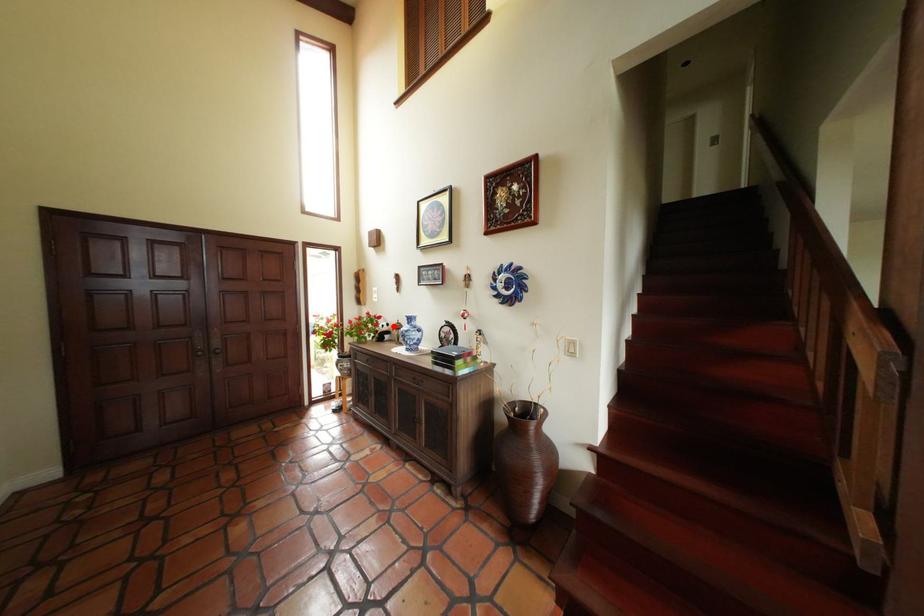
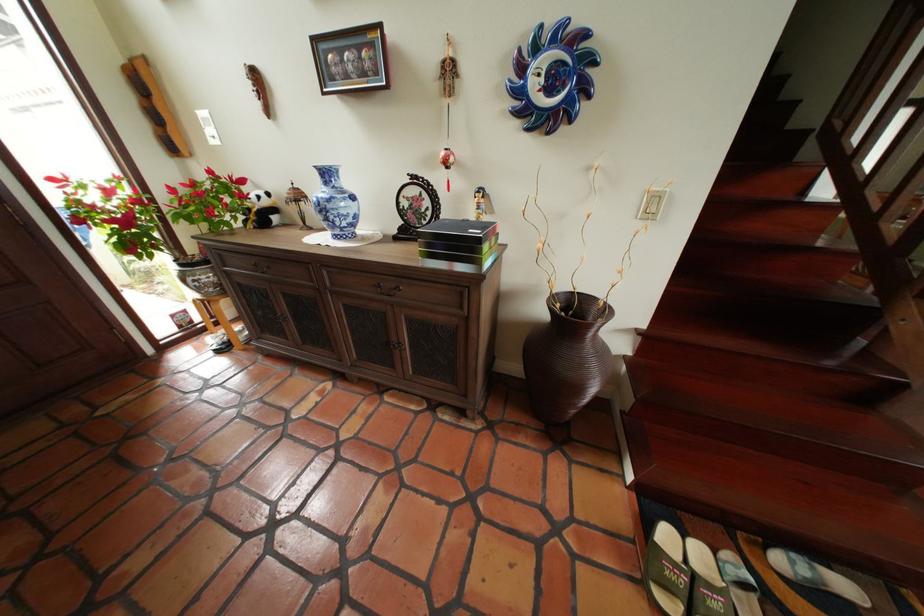
In the second image, find the point that corresponds to the highlighted location in the first image.

(265, 197)